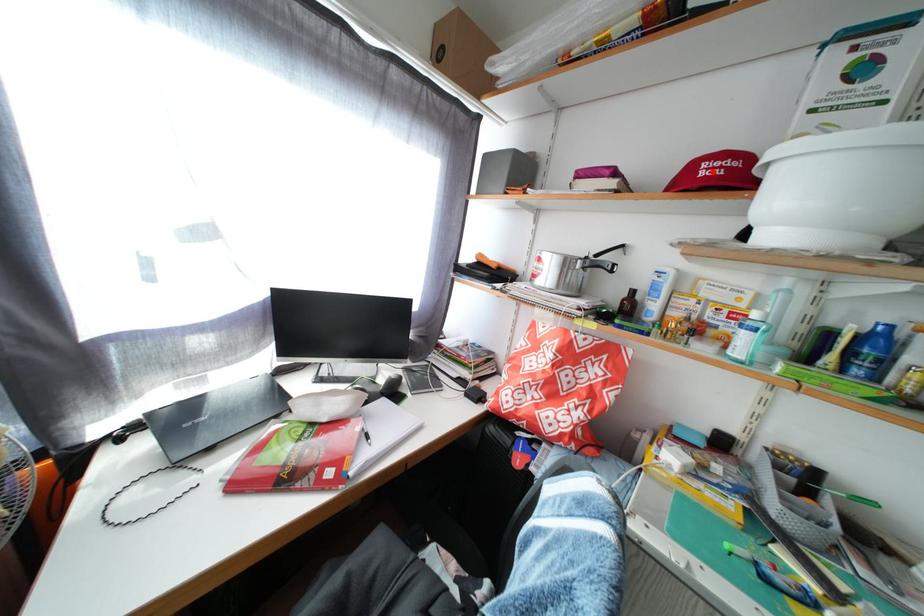
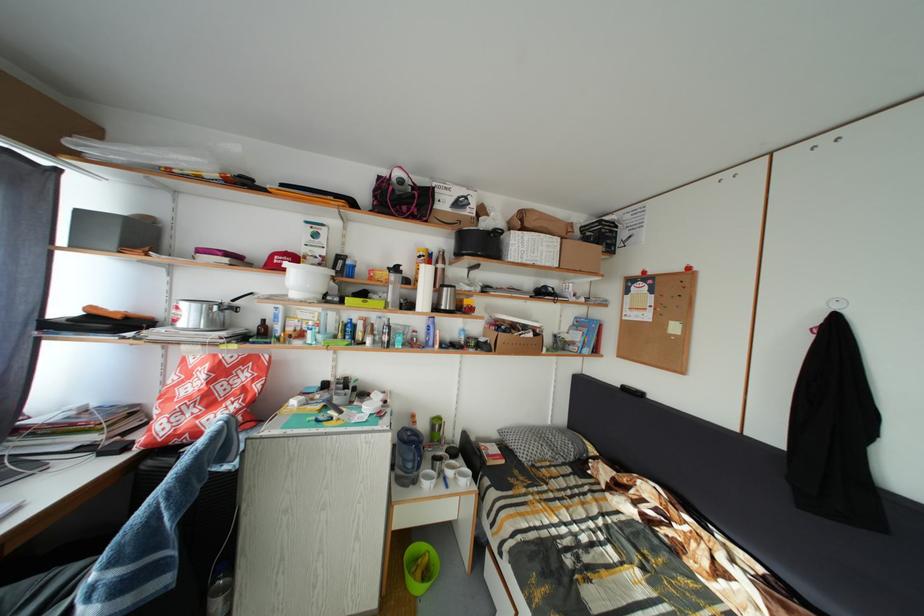
Find the pixel in the second image that matches the highlighted location in the first image.

(285, 264)